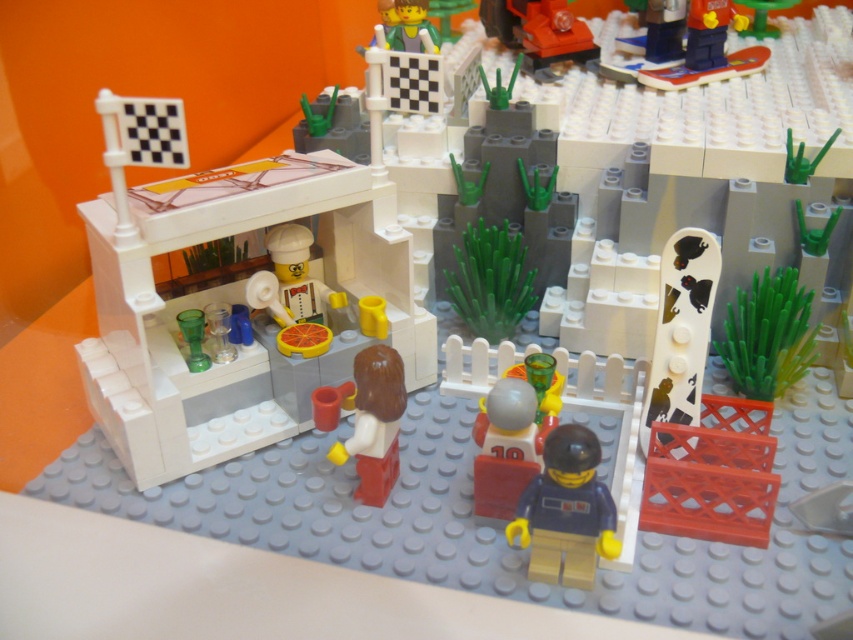
Who is positioned more to the left, white matte figure at center or smooth plastic minifigure at center?

From the viewer's perspective, white matte figure at center appears more on the left side.

Can you confirm if white matte figure at center is wider than smooth plastic minifigure at center?

No, white matte figure at center is not wider than smooth plastic minifigure at center.

Is point (370, 381) positioned before point (421, 45)?

Yes.

Identify the location of white matte figure at center. The height and width of the screenshot is (640, 853). (374, 422).

Can you confirm if smooth gray head at center is positioned below smooth plastic minifigure at center?

Yes.

Is point (503, 422) closer to camera compared to point (386, 13)?

Yes, point (503, 422) is closer to viewer.

Is point (502, 381) positioned behind point (386, 29)?

No, it is in front of (386, 29).

Locate an element on the screen. smooth gray head at center is located at coordinates (506, 445).

Is point (279, 160) positioned after point (543, 420)?

Yes, it is behind point (543, 420).

Is point (322, 298) positioned in front of point (553, 362)?

No, (322, 298) is further to viewer.

Find the location of a particular element. white plastic stand at center is located at coordinates (233, 300).